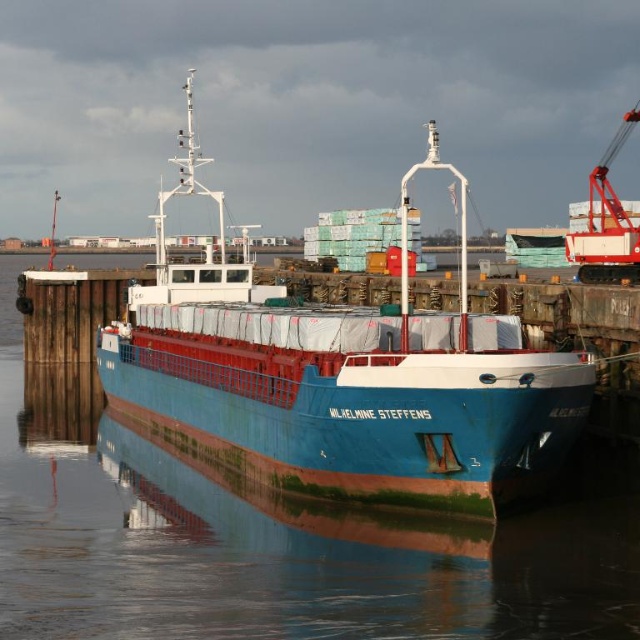
Question: Can you confirm if blue glossy water at center is positioned above blue matte cargo ship at center?

Choices:
 (A) yes
 (B) no

Answer: (B)

Question: Which point is closer to the camera?

Choices:
 (A) (74, 365)
 (B) (372, 355)

Answer: (B)

Question: Among these points, which one is nearest to the camera?

Choices:
 (A) (188, 369)
 (B) (160, 614)

Answer: (B)

Question: Is blue glossy water at center above blue matte cargo ship at center?

Choices:
 (A) yes
 (B) no

Answer: (B)

Question: Can you confirm if blue glossy water at center is positioned below blue matte cargo ship at center?

Choices:
 (A) yes
 (B) no

Answer: (A)

Question: Among these objects, which one is farthest from the camera?

Choices:
 (A) blue matte cargo ship at center
 (B) blue glossy water at center

Answer: (A)